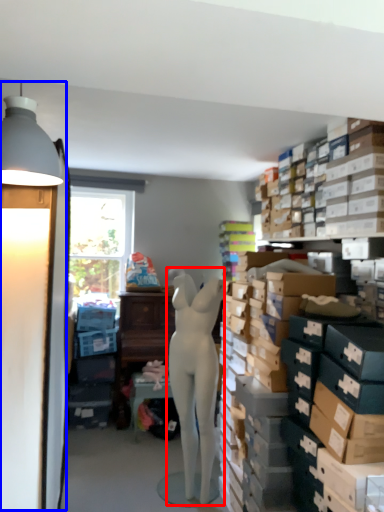
Question: Which point is further to the camera, person (highlighted by a red box) or table lamp (highlighted by a blue box)?

Choices:
 (A) person
 (B) table lamp

Answer: (A)